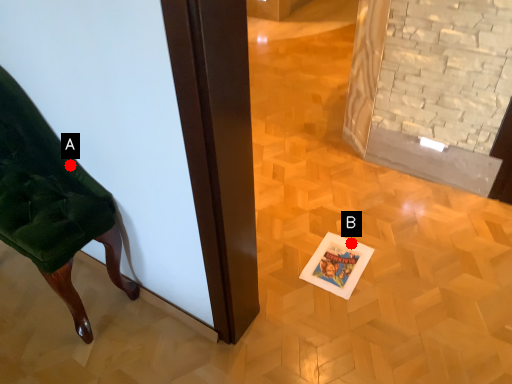
Question: Two points are circled on the image, labeled by A and B beside each circle. Which point appears closest to the camera in this image?

Choices:
 (A) A is closer
 (B) B is closer

Answer: (A)